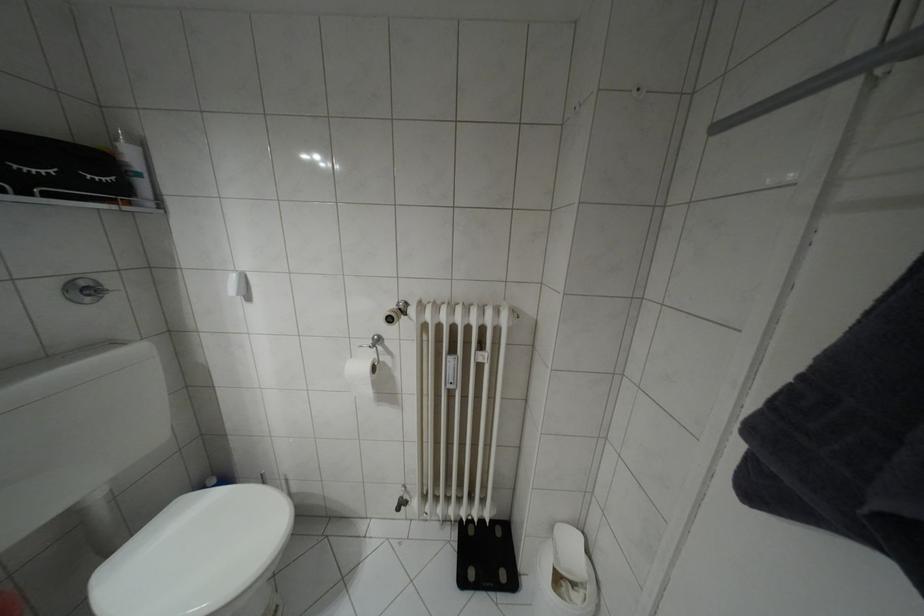
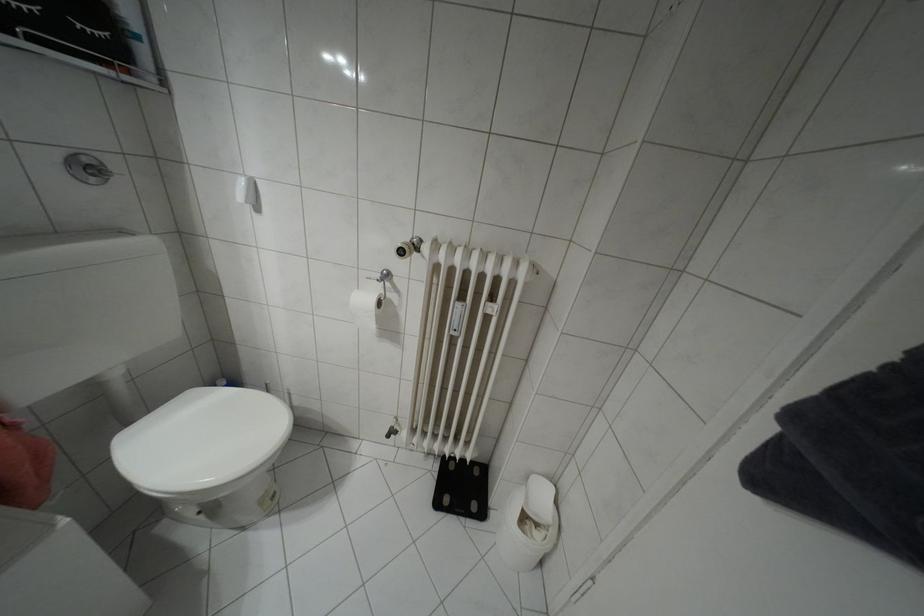
Question: The images are taken continuously from a first-person perspective. In which direction is your viewpoint rotating?

Choices:
 (A) Left
 (B) Right
 (C) Up
 (D) Down

Answer: (D)